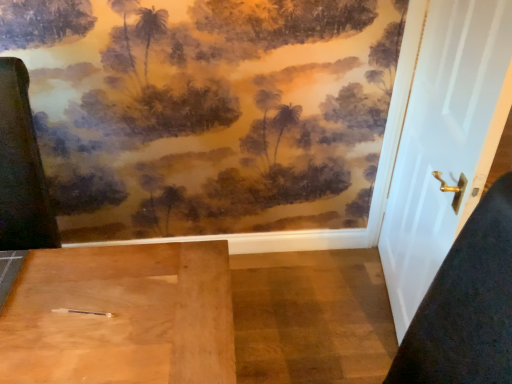
Describe the element at coordinates (121, 316) in the screenshot. I see `wooden pen at lower left` at that location.

This screenshot has width=512, height=384. In order to click on wooden pen at lower left in this screenshot , I will do `click(121, 316)`.

This screenshot has height=384, width=512. Find the location of `wooden pen at lower left`. wooden pen at lower left is located at coordinates (121, 316).